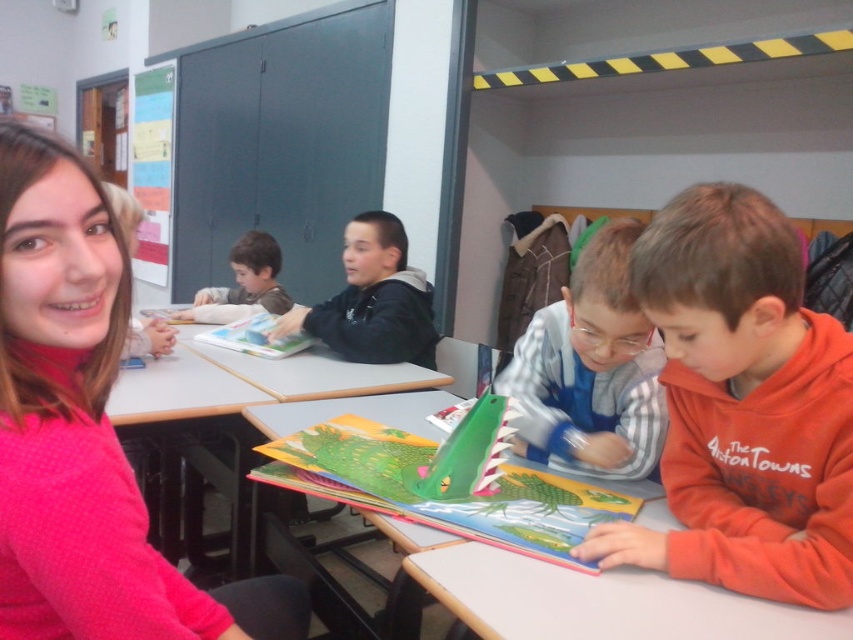
Who is shorter, orange fleece sweatshirt at lower right or light brown hoodie at center?

light brown hoodie at center is shorter.

Is orange fleece sweatshirt at lower right bigger than light brown hoodie at center?

No.

Is point (843, 579) closer to viewer compared to point (271, 268)?

Yes, point (843, 579) is closer to viewer.

Find the location of a particular element. orange fleece sweatshirt at lower right is located at coordinates (743, 406).

Does orange fleece sweatshirt at lower right come behind blue striped shirt at center?

No, orange fleece sweatshirt at lower right is closer to the viewer.

Identify the location of orange fleece sweatshirt at lower right. (743, 406).

Is point (759, 456) farther from viewer compared to point (602, 268)?

No, it is in front of (602, 268).

Locate an element on the screen. This screenshot has height=640, width=853. orange fleece sweatshirt at lower right is located at coordinates pyautogui.click(x=743, y=406).

Describe the element at coordinates (195, 422) in the screenshot. I see `matte plastic table at left` at that location.

Which of these two, matte plastic table at left or hardcover book at center, stands shorter?

With less height is hardcover book at center.

Which is behind, point (146, 422) or point (259, 340)?

Positioned behind is point (259, 340).

Locate an element on the screen. Image resolution: width=853 pixels, height=640 pixels. matte plastic table at left is located at coordinates (195, 422).